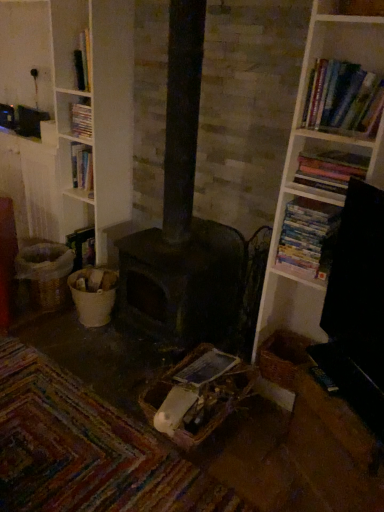
Question: Considering the positions of white paperbacks at right, arranged as the second book when viewed from the left, and hardcover books at upper right, which is counted as the first book, starting from the right, in the image, is white paperbacks at right, arranged as the second book when viewed from the left, wider or thinner than hardcover books at upper right, which is counted as the first book, starting from the right,?

Choices:
 (A) thin
 (B) wide

Answer: (A)

Question: Would you say white paperbacks at right, arranged as the second book when viewed from the left, is to the left or to the right of hardcover books at upper right, marked as the 4th book in a left-to-right arrangement, in the picture?

Choices:
 (A) right
 (B) left

Answer: (B)

Question: Which object is positioned farthest from the hardcover book at upper left, which is counted as the fourth book, starting from the front?

Choices:
 (A) woven brown basket at lower right, which is the second basket from front to back
 (B) white paperbacks at right, the third book in the right-to-left sequence
 (C) dark matte heater at center
 (D) hardcover books at upper right, which ranks as the first book in front-to-back order
 (E) woven brown basket at lower left, placed as the 1th basket when sorted from left to right

Answer: (A)

Question: Estimate the real-world distances between objects in this image. Which object is closer to the hardcover books at upper right, which appears as the second book when viewed from the front?

Choices:
 (A) white paperbacks at right, arranged as the third book when viewed from the front
 (B) hardcover books at upper right, the fourth book from the back
 (C) woven brown basket at center, the 2th basket when ordered from left to right
 (D) woven brown basket at lower left, the third basket viewed from the front
 (E) dark matte heater at center

Answer: (A)